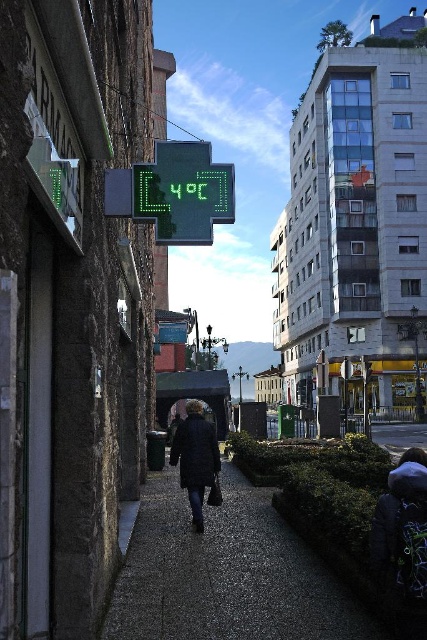
Can you confirm if dark gray gravel at center is wider than dark blue coat at center?

Yes.

Is point (180, 502) positioned behind point (210, 449)?

Yes, point (180, 502) is behind point (210, 449).

The image size is (427, 640). I want to click on dark gray gravel at center, so click(225, 573).

Is dark gray jacket at lower right below dark blue coat at center?

No, dark gray jacket at lower right is not below dark blue coat at center.

You are a GUI agent. You are given a task and a screenshot of the screen. Output one action in this format:
    pyautogui.click(x=<x>, y=<y>)
    Task: Click on the dark gray jacket at lower right
    This screenshot has height=640, width=427.
    Given the screenshot: What is the action you would take?
    pyautogui.click(x=403, y=531)

Find the location of a particular element. green plastic thermometer at upper center is located at coordinates (183, 193).

Which is behind, point (193, 243) or point (397, 584)?

Point (193, 243)

Locate an element on the screen. green plastic thermometer at upper center is located at coordinates (183, 193).